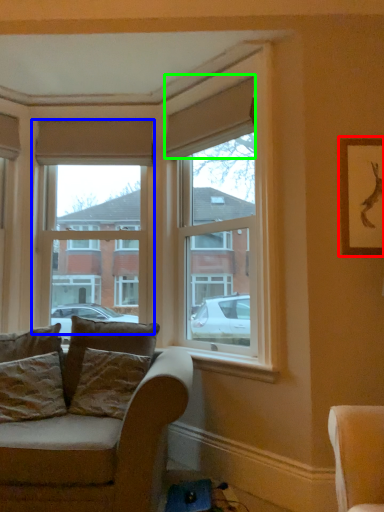
Question: Considering the real-world distances, which object is closest to picture frame (highlighted by a red box)? window (highlighted by a blue box) or curtain (highlighted by a green box).

Choices:
 (A) window
 (B) curtain

Answer: (B)